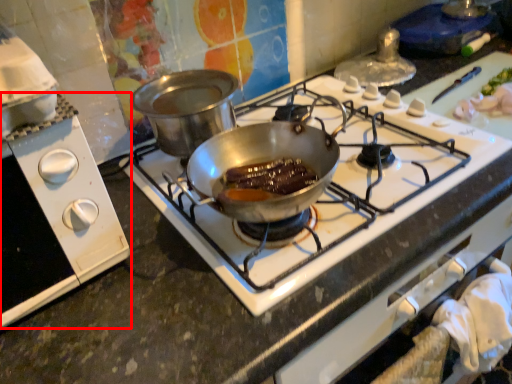
Question: From the image's perspective, considering the relative positions of kitchen appliance (annotated by the red box) and gas stove in the image provided, where is kitchen appliance (annotated by the red box) located with respect to the staircase?

Choices:
 (A) below
 (B) above

Answer: (A)